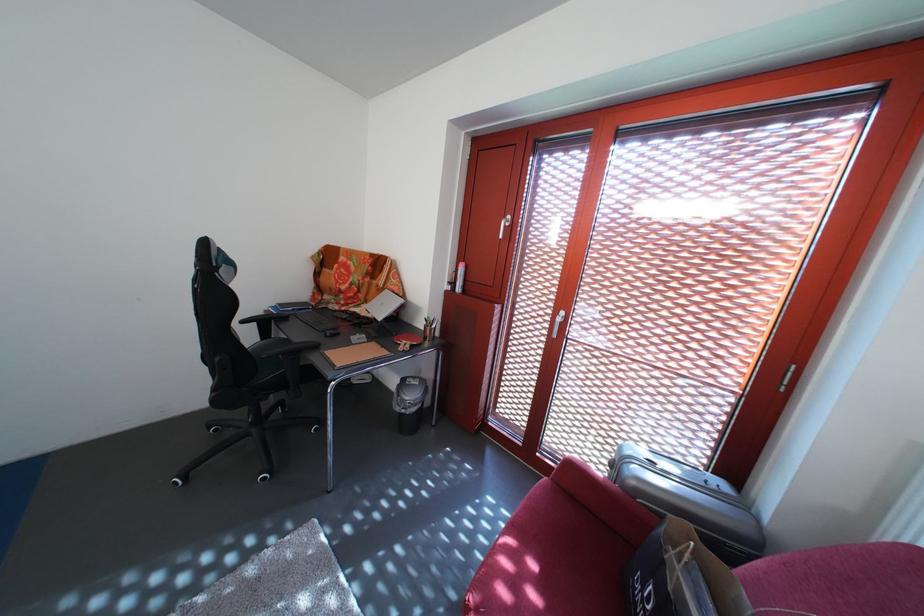
This screenshot has height=616, width=924. Find the location of `black chair armrest`. black chair armrest is located at coordinates (264, 320).